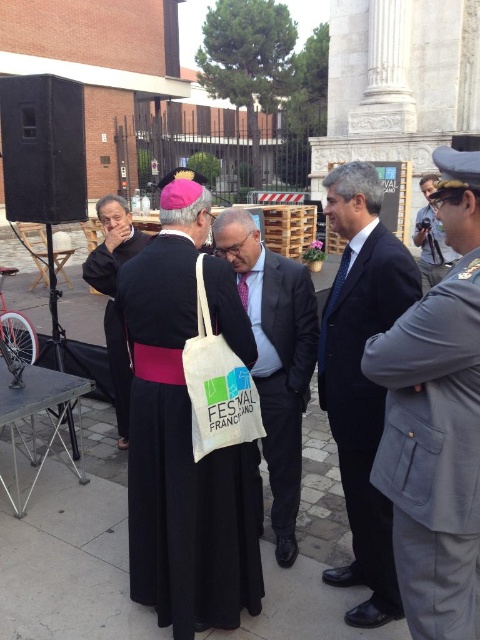
Question: Does black fabric dress at center appear under dark blue suit at center?

Choices:
 (A) yes
 (B) no

Answer: (A)

Question: Does black velvet robe at left have a smaller size compared to metallic silver camera at right?

Choices:
 (A) no
 (B) yes

Answer: (B)

Question: Which point is farther from the camera taking this photo?

Choices:
 (A) pyautogui.click(x=391, y=552)
 (B) pyautogui.click(x=159, y=264)
 (C) pyautogui.click(x=422, y=289)
 (D) pyautogui.click(x=263, y=300)

Answer: (C)

Question: Estimate the real-world distances between objects in this image. Which object is closer to the gray uniform at right?

Choices:
 (A) black velvet robe at left
 (B) white fabric tote bag at center
 (C) metallic silver camera at right

Answer: (B)

Question: Which point is closer to the camera?

Choices:
 (A) (372, 308)
 (B) (424, 186)

Answer: (A)

Question: Does white fabric tote bag at center have a smaller size compared to metallic silver camera at right?

Choices:
 (A) no
 (B) yes

Answer: (B)